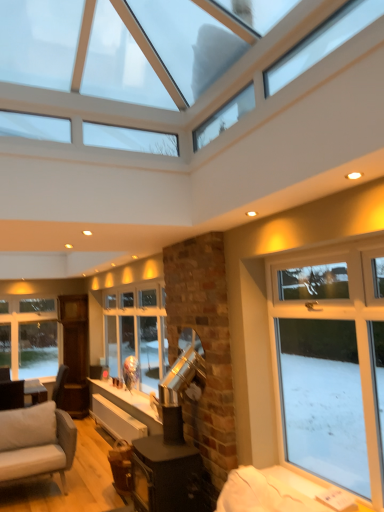
Question: Is white glass window at lower left, the 1th window viewed from the back, in contact with clear glass window at upper center, positioned as the 1th window in top-to-bottom order?

Choices:
 (A) yes
 (B) no

Answer: (B)

Question: Is white glass window at lower left, the 1th window viewed from the back, not within clear glass window at upper center, which appears as the 1th window when viewed from the front?

Choices:
 (A) no
 (B) yes

Answer: (B)

Question: Considering the relative sizes of white glass window at lower left, the 1th window viewed from the back, and clear glass window at upper center, which is the second window from bottom to top, in the image provided, is white glass window at lower left, the 1th window viewed from the back, taller than clear glass window at upper center, which is the second window from bottom to top,?

Choices:
 (A) no
 (B) yes

Answer: (B)

Question: From a real-world perspective, is white glass window at lower left, the 1th window positioned from the bottom, physically above clear glass window at upper center, the 2th window from the back?

Choices:
 (A) no
 (B) yes

Answer: (A)

Question: Is the depth of white glass window at lower left, the 1th window viewed from the back, less than that of clear glass window at upper center, the 2th window from the back?

Choices:
 (A) no
 (B) yes

Answer: (A)

Question: Can you confirm if white glass window at lower left, the 1th window positioned from the bottom, is bigger than clear glass window at upper center, the 2th window from the back?

Choices:
 (A) yes
 (B) no

Answer: (B)

Question: Can you confirm if clear glass window at upper center, positioned as the 1th window in top-to-bottom order, is thinner than white glass window at lower left, which is the second window in top-to-bottom order?

Choices:
 (A) yes
 (B) no

Answer: (B)

Question: Can you confirm if clear glass window at upper center, which appears as the 1th window when viewed from the front, is wider than white glass window at lower left, which is the second window in top-to-bottom order?

Choices:
 (A) yes
 (B) no

Answer: (A)

Question: Is clear glass window at upper center, the 2th window from the back, looking in the opposite direction of white glass window at lower left, the 1th window viewed from the back?

Choices:
 (A) no
 (B) yes

Answer: (A)

Question: Considering the relative sizes of clear glass window at upper center, which appears as the 1th window when viewed from the front, and white glass window at lower left, the 1th window viewed from the back, in the image provided, is clear glass window at upper center, which appears as the 1th window when viewed from the front, taller than white glass window at lower left, the 1th window viewed from the back,?

Choices:
 (A) yes
 (B) no

Answer: (B)

Question: Is clear glass window at upper center, which is the second window from bottom to top, to the right of white glass window at lower left, the 1th window viewed from the back, from the viewer's perspective?

Choices:
 (A) no
 (B) yes

Answer: (B)

Question: From the image's perspective, is clear glass window at upper center, which appears as the 1th window when viewed from the front, located beneath white glass window at lower left, the second window viewed from the front?

Choices:
 (A) yes
 (B) no

Answer: (B)

Question: Based on their positions, is clear glass window at upper center, positioned as the 1th window in top-to-bottom order, located to the left or right of white glass window at lower left, the 1th window viewed from the back?

Choices:
 (A) left
 (B) right

Answer: (B)